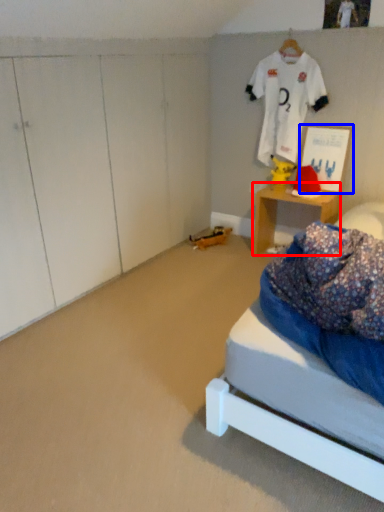
Question: Which of the following is the closest to the observer, desk (highlighted by a red box) or picture frame (highlighted by a blue box)?

Choices:
 (A) desk
 (B) picture frame

Answer: (B)